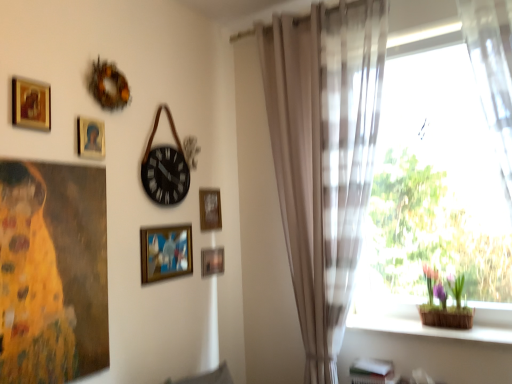
Find the location of a particular element. This screenshot has width=512, height=384. vacant region to the left of green leafy plant at right is located at coordinates (411, 327).